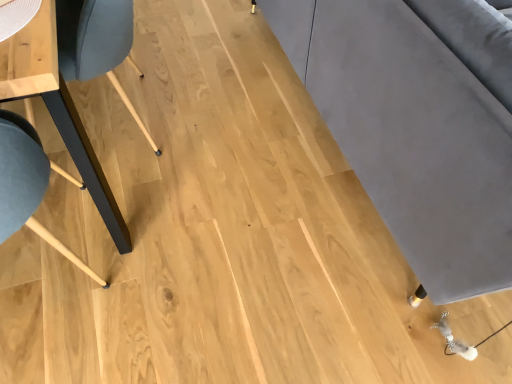
The width and height of the screenshot is (512, 384). Describe the element at coordinates (57, 107) in the screenshot. I see `matte wood table at left` at that location.

Identify the location of matte wood table at left. This screenshot has width=512, height=384. (57, 107).

In order to face matte wood table at left, should I rotate leftwards or rightwards?

Turn left approximately 29.675 degrees to face it.

What do you see at coordinates (418, 124) in the screenshot? I see `velvet grey couch at right` at bounding box center [418, 124].

Locate an element on the screen. The image size is (512, 384). velvet grey couch at right is located at coordinates (418, 124).

You are a GUI agent. You are given a task and a screenshot of the screen. Output one action in this format:
    pyautogui.click(x=<x>, y=<y>)
    Task: Click on the matte wood table at left
    Image resolution: width=512 pixels, height=384 pixels.
    Given the screenshot: What is the action you would take?
    pyautogui.click(x=57, y=107)

Which object is positioned more to the left, matte wood table at left or velvet grey couch at right?

From the viewer's perspective, matte wood table at left appears more on the left side.

Is matte wood table at left in front of or behind velvet grey couch at right in the image?

In the image, matte wood table at left appears behind velvet grey couch at right.

Is point (55, 117) behind point (477, 269)?

Yes, point (55, 117) is behind point (477, 269).

From the image's perspective, is matte wood table at left beneath velvet grey couch at right?

Correct, matte wood table at left appears lower than velvet grey couch at right in the image.

From a real-world perspective, is matte wood table at left physically located above or below velvet grey couch at right?

From a real-world perspective, matte wood table at left is physically below velvet grey couch at right.

Considering the sizes of matte wood table at left and velvet grey couch at right in the image, is matte wood table at left wider or thinner than velvet grey couch at right?

Considering their sizes, matte wood table at left looks slimmer than velvet grey couch at right.

Considering the relative sizes of matte wood table at left and velvet grey couch at right in the image provided, is matte wood table at left taller than velvet grey couch at right?

Incorrect, the height of matte wood table at left is not larger of that of velvet grey couch at right.

Does matte wood table at left have a larger size compared to velvet grey couch at right?

Actually, matte wood table at left might be smaller than velvet grey couch at right.

Is matte wood table at left outside of velvet grey couch at right?

Yes.

Is matte wood table at left far from velvet grey couch at right?

matte wood table at left is near velvet grey couch at right, not far away.

Could you tell me if matte wood table at left is facing velvet grey couch at right?

Yes, matte wood table at left is oriented towards velvet grey couch at right.

Image resolution: width=512 pixels, height=384 pixels. I want to click on table behind the velvet grey couch at right, so click(x=57, y=107).

Is velvet grey couch at right at the right side of matte wood table at left?

Correct, you'll find velvet grey couch at right to the right of matte wood table at left.

Considering the positions of objects velvet grey couch at right and matte wood table at left in the image provided, who is in front, velvet grey couch at right or matte wood table at left?

velvet grey couch at right.

Considering the points (497, 67) and (40, 86), which point is behind, point (497, 67) or point (40, 86)?

The point (497, 67) is farther from the camera.

Based on the photo, from the image's perspective, would you say velvet grey couch at right is shown under matte wood table at left?

No.

From a real-world perspective, which is physically below, velvet grey couch at right or matte wood table at left?

matte wood table at left.

Considering the sizes of velvet grey couch at right and matte wood table at left in the image, is velvet grey couch at right wider or thinner than matte wood table at left?

Considering their sizes, velvet grey couch at right looks broader than matte wood table at left.

In terms of height, does velvet grey couch at right look taller or shorter compared to matte wood table at left?

Considering their sizes, velvet grey couch at right has more height than matte wood table at left.

Which of these two, velvet grey couch at right or matte wood table at left, is smaller?

Smaller between the two is matte wood table at left.

Could matte wood table at left be considered to be inside velvet grey couch at right?

That's incorrect, matte wood table at left is not inside velvet grey couch at right.

Are velvet grey couch at right and matte wood table at left beside each other?

velvet grey couch at right is not next to matte wood table at left, and they're not touching.

Is velvet grey couch at right oriented towards matte wood table at left?

No, velvet grey couch at right is not aimed at matte wood table at left.

How many degrees apart are the facing directions of velvet grey couch at right and matte wood table at left?

The angle between the facing direction of velvet grey couch at right and the facing direction of matte wood table at left is 1.5 degrees.

What are the coordinates of `couch on the right side of matte wood table at left` in the screenshot? It's located at pos(418,124).

I want to click on table located behind the velvet grey couch at right, so click(57, 107).

Image resolution: width=512 pixels, height=384 pixels. I want to click on table located on the left of velvet grey couch at right, so click(57, 107).